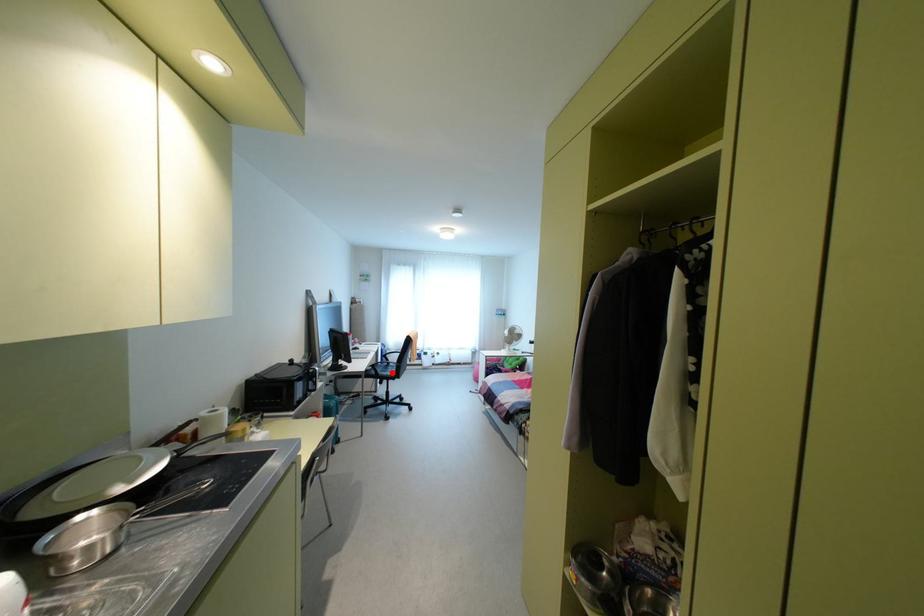
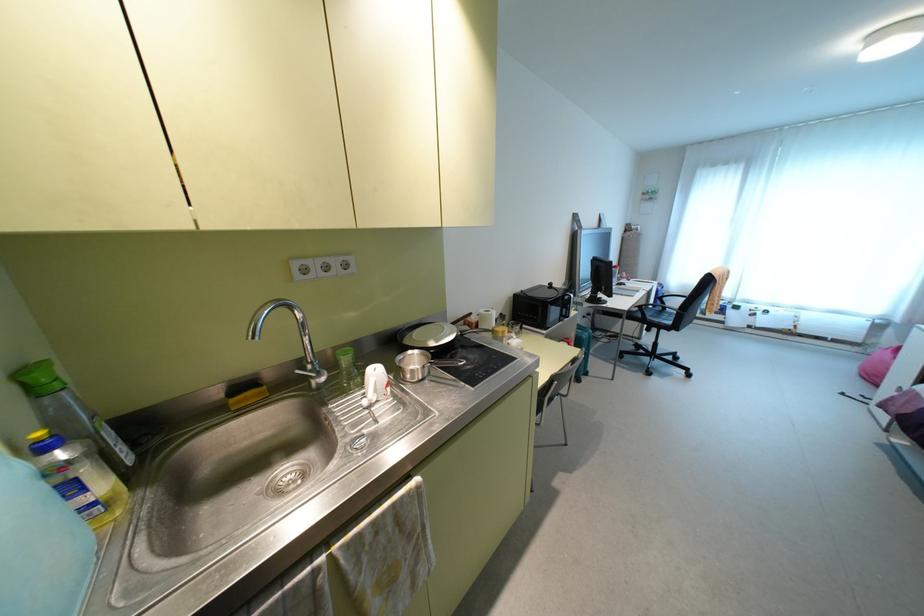
Question: I am providing you with two images of the same scene from different viewpoints. A red point is marked on the first image. Is the red point's position out of view in image 2?

Choices:
 (A) Yes
 (B) No

Answer: (B)